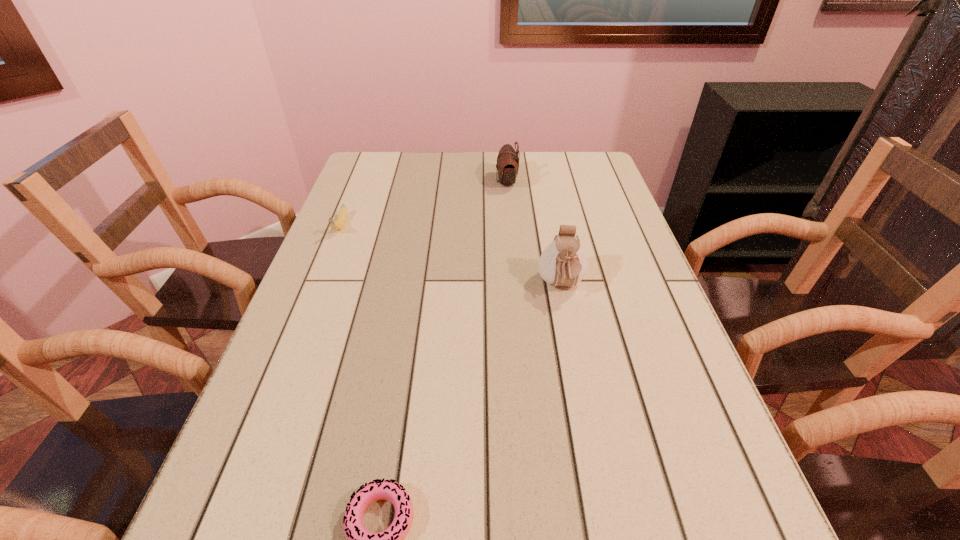
This screenshot has height=540, width=960. What are the coordinates of `object that is the third closest one to the farthest object` in the screenshot? It's located at (359, 539).

Point out which object is positioned as the third nearest to the taller pouch. Please provide its 2D coordinates. Your answer should be formatted as a tuple, i.e. [(x, y)], where the tuple contains the x and y coordinates of a point satisfying the conditions above.

[(340, 222)]

The width and height of the screenshot is (960, 540). I want to click on vacant space that satisfies the following two spatial constraints: 1. with the flap open on the left pouch; 2. at the stem of the banana, so click(511, 227).

In order to click on free region that satisfies the following two spatial constraints: 1. with the flap open on the left pouch; 2. at the stem of the third tallest object in this screenshot , I will do `click(511, 227)`.

Find the location of `vacant space that satisfies the following two spatial constraints: 1. with the flap open on the shorter pouch; 2. at the stem of the leftmost object`. vacant space that satisfies the following two spatial constraints: 1. with the flap open on the shorter pouch; 2. at the stem of the leftmost object is located at coordinates (511, 227).